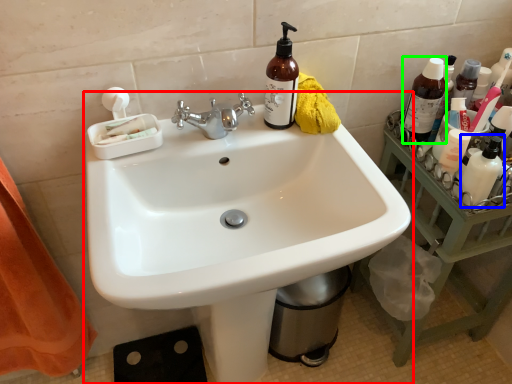
Question: Estimate the real-world distances between objects in this image. Which object is farther from sink (highlighted by a red box), toiletry (highlighted by a blue box) or bottle (highlighted by a green box)?

Choices:
 (A) toiletry
 (B) bottle

Answer: (B)